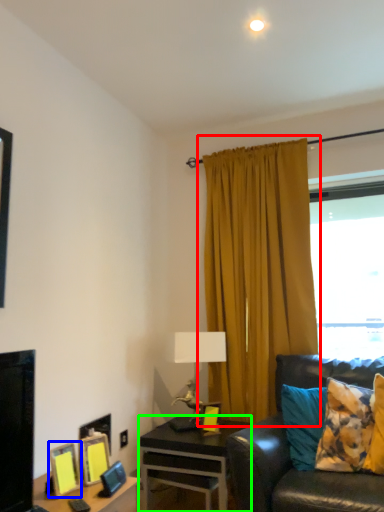
Question: Which is nearer to the curtain (highlighted by a red box)? picture frame (highlighted by a blue box) or desk (highlighted by a green box).

Choices:
 (A) picture frame
 (B) desk

Answer: (B)